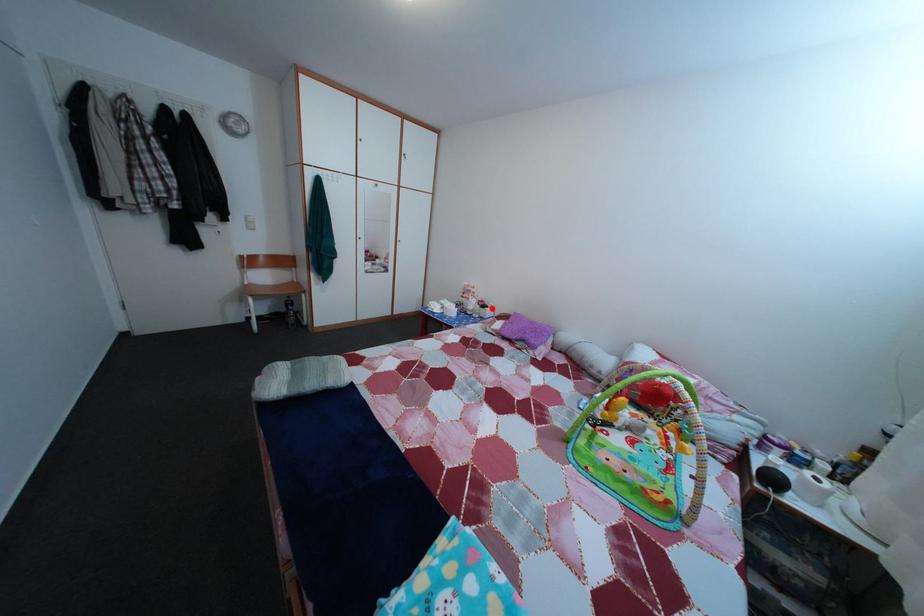
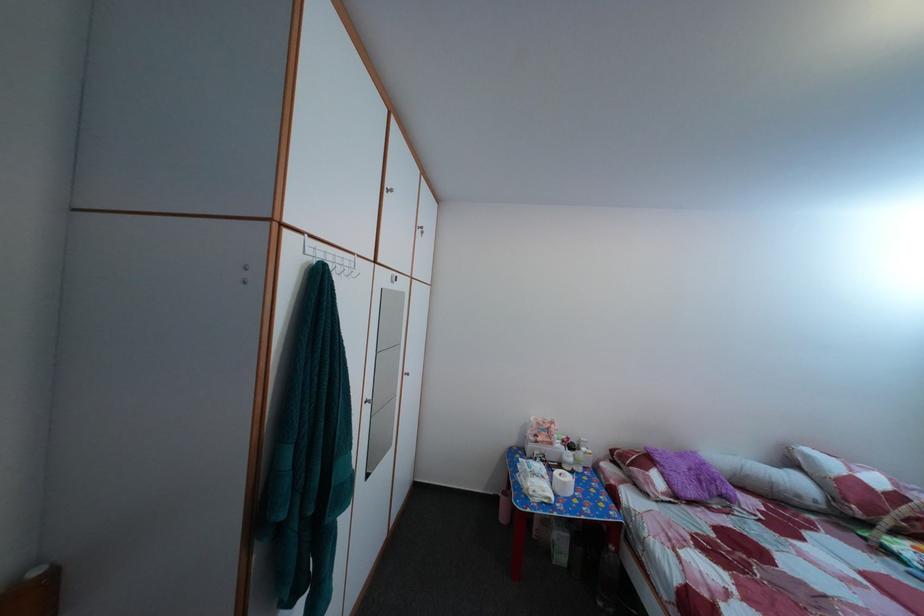
In the second image, find the point that corresponds to the highlighted location in the first image.

(578, 447)